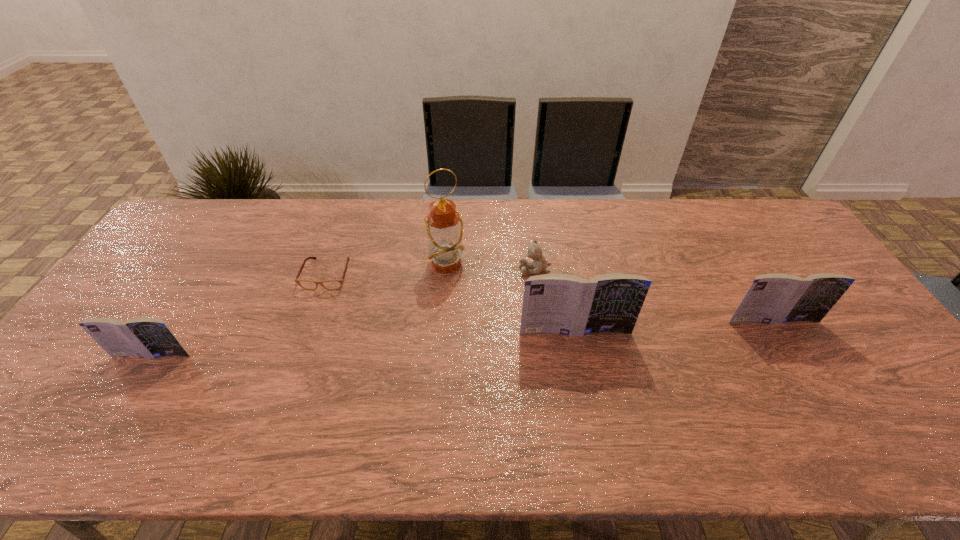
Locate an element on the screen. The height and width of the screenshot is (540, 960). teddy bear is located at coordinates (539, 263).

Where is `vacant area located on the front cover of the fourth tallest object`? This screenshot has height=540, width=960. vacant area located on the front cover of the fourth tallest object is located at coordinates (118, 409).

I want to click on blank space located on the front cover of the fifth farthest object, so click(x=583, y=372).

Where is `free location located on the front cover of the farthest book`? Image resolution: width=960 pixels, height=540 pixels. free location located on the front cover of the farthest book is located at coordinates (821, 401).

I want to click on vacant space situated on the left of the oil lamp, so click(x=390, y=264).

Where is `vacant area situated on the front-facing side of the second object from left to right`? The width and height of the screenshot is (960, 540). vacant area situated on the front-facing side of the second object from left to right is located at coordinates (307, 333).

This screenshot has width=960, height=540. Identify the location of free point located 0.090m on the face of the teddy bear. (491, 269).

The height and width of the screenshot is (540, 960). What are the coordinates of `free space located on the face of the teddy bear` in the screenshot? It's located at (454, 269).

The image size is (960, 540). I want to click on free point located on the face of the teddy bear, so click(x=477, y=269).

At what (x,y) coordinates should I click in order to perform the action: click on object that is at the left edge. Please return your answer as a coordinate pair (x, y). This screenshot has height=540, width=960. Looking at the image, I should click on (148, 337).